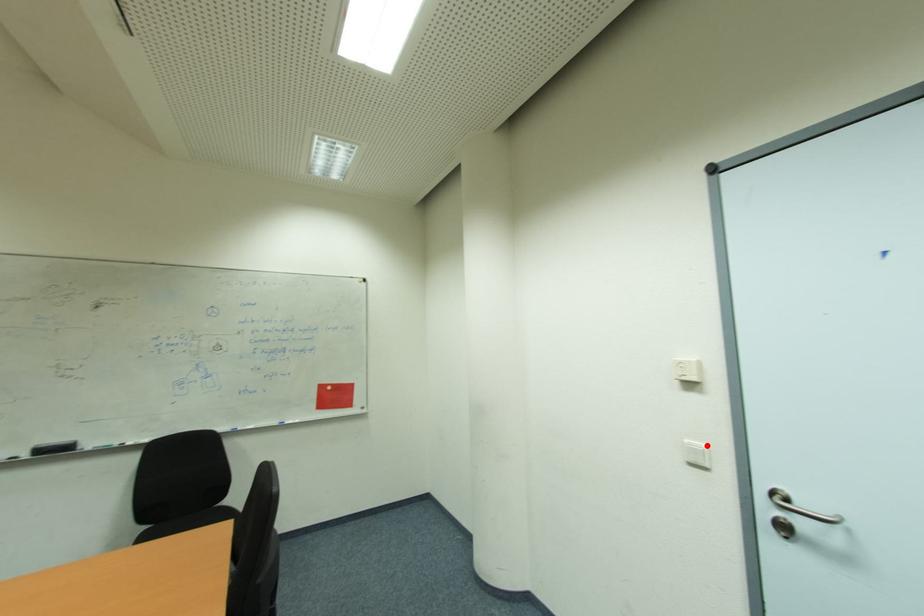
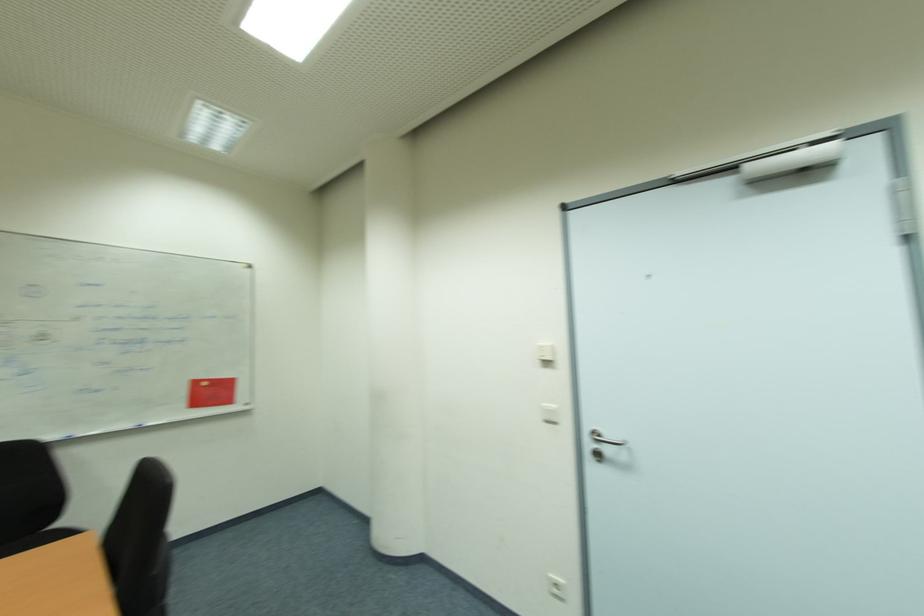
The point at the highlighted location is marked in the first image. Where is the corresponding point in the second image?

(556, 407)